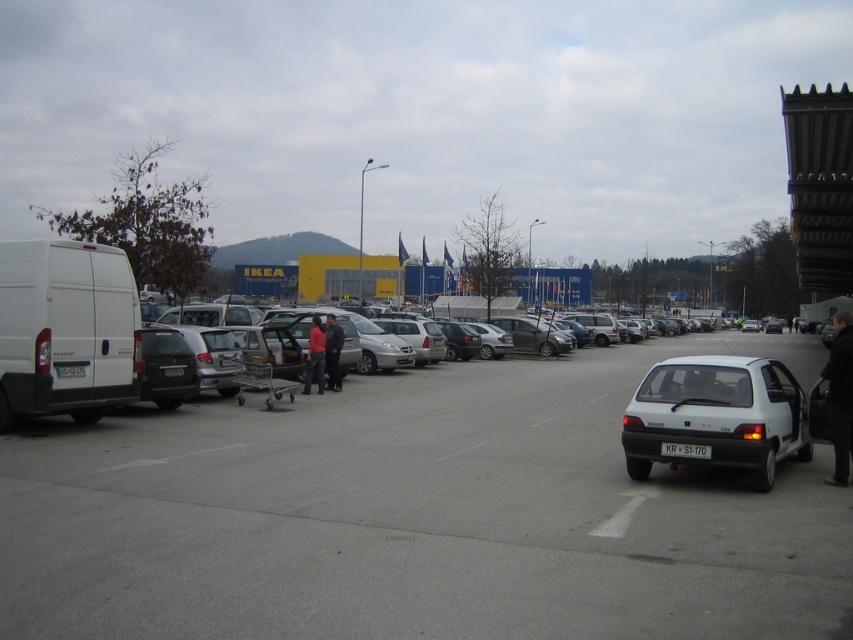
You are standing at the entrance of the IKEA store and want to locate your car, the white matte car at center. According to the coordinates provided, where should you look to find it?

The white matte car at center is located at coordinates point [416,515], so you should look towards the center of the parking lot near that point to find it.

You are standing at the entrance of the IKEA store and want to locate your car, which is the white matte car at center. If you face the store entrance, which direction should you walk to reach your car?

Since the white matte car at center is located at coordinates (416,515) in the image, it is positioned to the right and slightly forward from the entrance. Therefore, you should walk towards the right side of the store to reach your car.

You are a customer who just parked your car and are now standing near the red jacket at center. You need to retrieve your keys from your car, which is the white matte car at center. Can you reach your car without moving from your current position?

The white matte car at center is positioned on the right side of the red jacket at center. Since you are standing near the red jacket at center, you can reach the white matte car at center by moving to your right side without needing to move far from your current position.